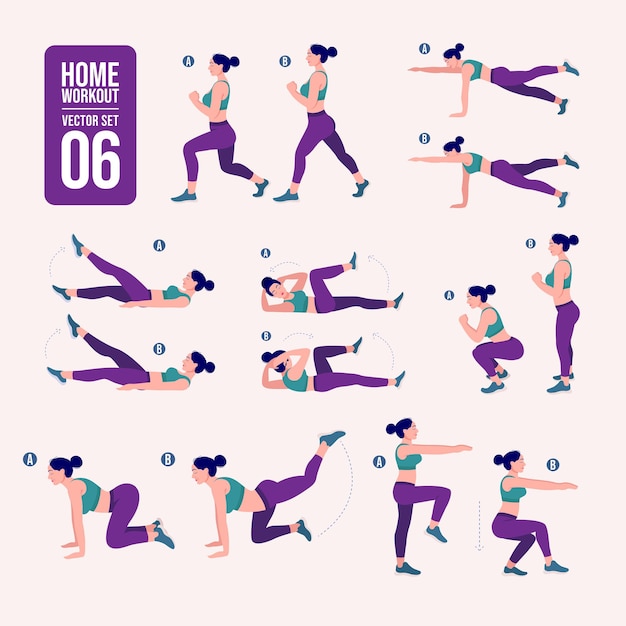
This screenshot has height=626, width=626. In order to click on workout poster in this screenshot , I will do `click(583, 601)`.